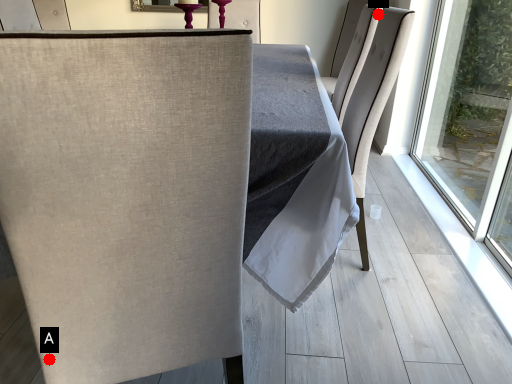
Question: Two points are circled on the image, labeled by A and B beside each circle. Which point is closer to the camera?

Choices:
 (A) A is closer
 (B) B is closer

Answer: (A)